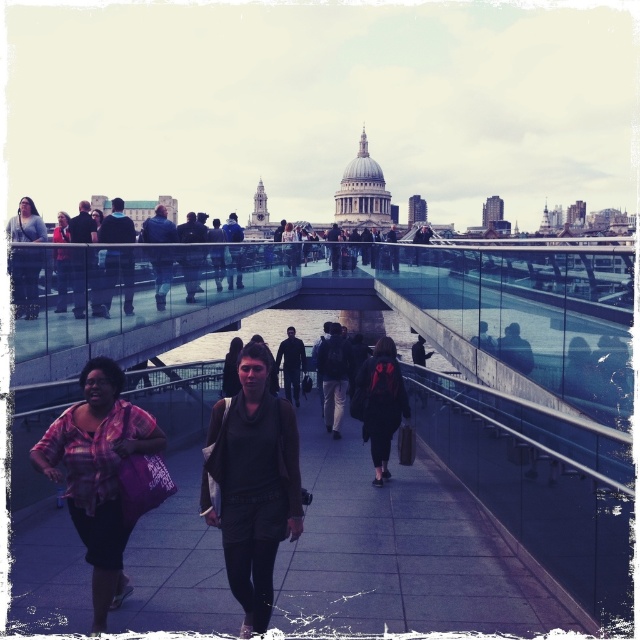
Is dark gray sweater at center below matte black jacket at left?

Yes, dark gray sweater at center is below matte black jacket at left.

Which is more to the left, dark gray sweater at center or matte black jacket at left?

Positioned to the left is matte black jacket at left.

Is point (240, 458) positioned behind point (12, 218)?

No, it is not.

At what (x,y) coordinates should I click in order to perform the action: click on dark gray sweater at center. Please return your answer as a coordinate pair (x, y). Image resolution: width=640 pixels, height=640 pixels. Looking at the image, I should click on (252, 483).

Which is behind, point (275, 595) or point (64, 212)?

Positioned behind is point (64, 212).

Which is more to the left, dark gray concrete pavement at center or matte pink shirt at left?

matte pink shirt at left is more to the left.

Is point (429, 470) in front of point (61, 224)?

Yes.

Identify the location of dark gray concrete pavement at center. (400, 552).

Can you confirm if dark gray sweater at center is bigger than plaid fabric shirt at lower left?

Yes, dark gray sweater at center is bigger than plaid fabric shirt at lower left.

Is dark gray sweater at center to the left of plaid fabric shirt at lower left from the viewer's perspective?

Incorrect, dark gray sweater at center is not on the left side of plaid fabric shirt at lower left.

At what (x,y) coordinates should I click in order to perform the action: click on dark gray sweater at center. Please return your answer as a coordinate pair (x, y). Image resolution: width=640 pixels, height=640 pixels. Looking at the image, I should click on (252, 483).

The width and height of the screenshot is (640, 640). I want to click on dark gray sweater at center, so click(x=252, y=483).